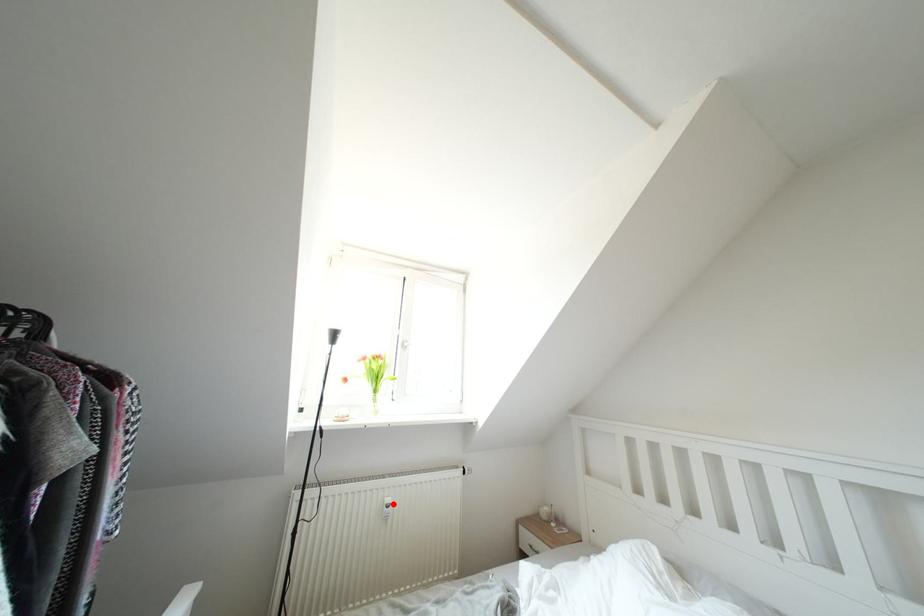
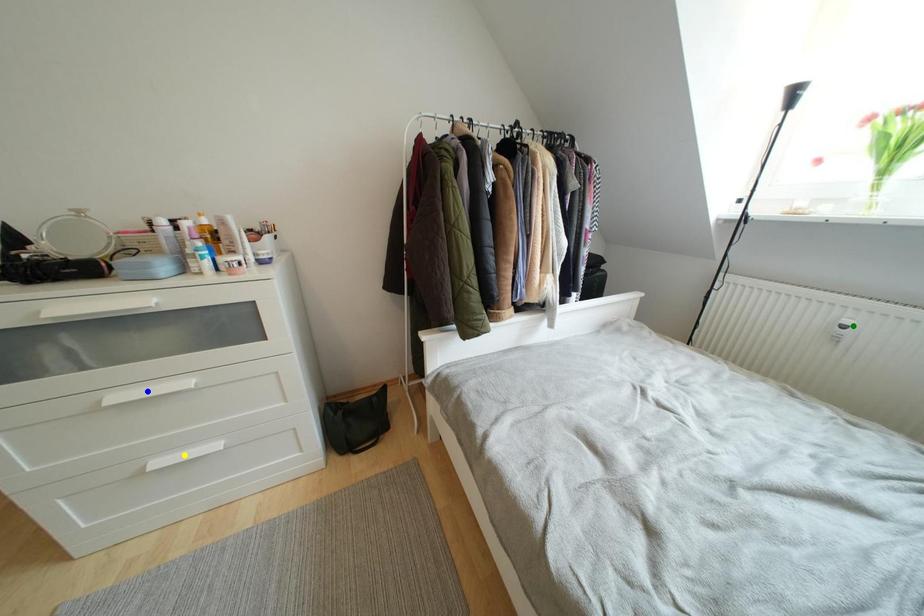
Question: I am providing you with two images of the same scene from different viewpoints. A red point is marked on the first image. You are given multiple points on the second image. Which spot in image 2 lines up with the point in image 1?

Choices:
 (A) blue point
 (B) yellow point
 (C) green point

Answer: (C)